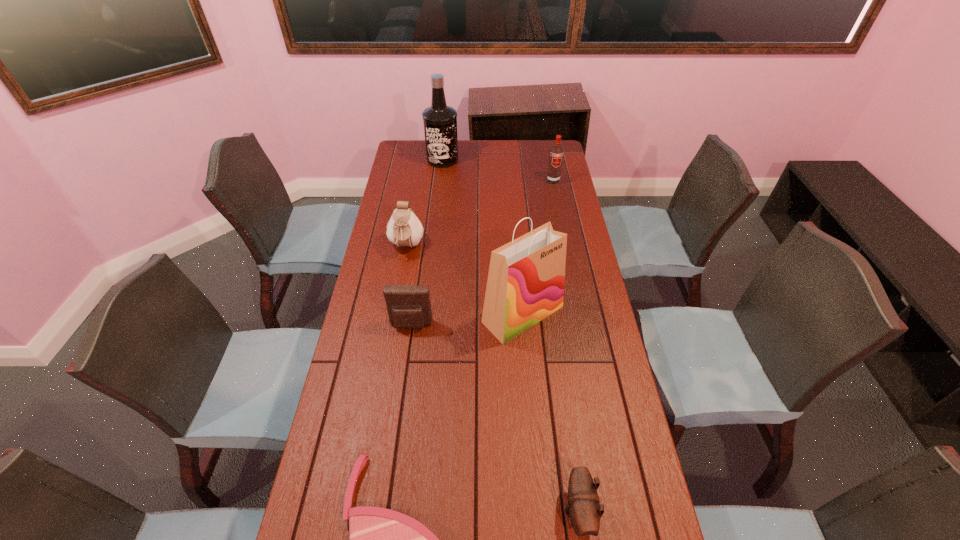
You are a GUI agent. You are given a task and a screenshot of the screen. Output one action in this format:
    pyautogui.click(x=<x>, y=<y>)
    Task: Click on the liquor
    
    Given the screenshot: What is the action you would take?
    (440, 121)

The width and height of the screenshot is (960, 540). Find the location of `shopping bag`. shopping bag is located at coordinates (525, 284).

Locate an element on the screen. the second farthest object is located at coordinates (556, 152).

At what (x,y) coordinates should I click in order to perform the action: click on vodka. Please return your answer as a coordinate pair (x, y). This screenshot has width=960, height=540. Looking at the image, I should click on (556, 152).

Identify the location of the fifth nearest object. (404, 228).

The image size is (960, 540). I want to click on the second farthest pouch, so click(x=408, y=306).

Identify the location of free space located 0.190m on the front label of the liquor. The width and height of the screenshot is (960, 540). (439, 192).

Find the location of a particular element. This screenshot has height=540, width=960. vacant region located on the back of the shopping bag is located at coordinates (516, 228).

You are a GUI agent. You are given a task and a screenshot of the screen. Output one action in this format:
    pyautogui.click(x=<x>, y=<y>)
    Task: Click on the free location located on the front label of the vodka
    
    Given the screenshot: What is the action you would take?
    pyautogui.click(x=560, y=215)

Where is `free space located 0.270m on the front-facing side of the fifth nearest object`? This screenshot has width=960, height=540. free space located 0.270m on the front-facing side of the fifth nearest object is located at coordinates (394, 319).